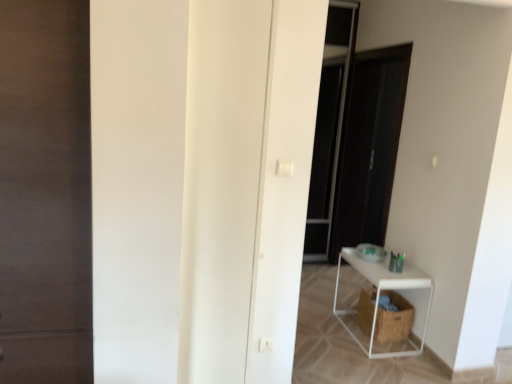
What is the approximate width of brown woven laundry basket at lower right?

It is 31.89 centimeters.

The height and width of the screenshot is (384, 512). Describe the element at coordinates (394, 319) in the screenshot. I see `brown woven laundry basket at lower right` at that location.

Describe the element at coordinates (379, 294) in the screenshot. This screenshot has height=384, width=512. I see `white matte shelf at lower right` at that location.

Describe the element at coordinates (221, 184) in the screenshot. I see `white matte door at center, the 1th door in the right-to-left sequence` at that location.

This screenshot has height=384, width=512. I want to click on dark wood door at left, which appears as the 2th door when viewed from the right, so pos(45,192).

Locate an element on the screen. The width and height of the screenshot is (512, 384). transparent glass screen door at center is located at coordinates (369, 147).

What is the approximate height of transparent glass screen door at center?

It is 6.88 feet.

Locate an element on the screen. The height and width of the screenshot is (384, 512). brown woven laundry basket at lower right is located at coordinates (394, 319).

Between transparent glass screen door at center and brown woven laundry basket at lower right, which one has larger size?

transparent glass screen door at center.

From a real-world perspective, which object stands above the other?

From a 3D spatial view, transparent glass screen door at center is above.

What are the coordinates of `laundry basket in front of the transparent glass screen door at center` in the screenshot? It's located at (394, 319).

Considering the relative positions of transparent glass screen door at center and brown woven laundry basket at lower right in the image provided, is transparent glass screen door at center to the right of brown woven laundry basket at lower right from the viewer's perspective?

Correct, you'll find transparent glass screen door at center to the right of brown woven laundry basket at lower right.

What are the coordinates of `screen door on the right side of dark wood door at left, which appears as the 2th door when viewed from the right` in the screenshot? It's located at (369, 147).

From the image's perspective, is transparent glass screen door at center located beneath dark wood door at left, which appears as the 2th door when viewed from the right?

No.

Is transparent glass screen door at center facing towards dark wood door at left, which appears as the first door when viewed from the left?

No.

Is white matte shelf at lower right spatially inside brown woven laundry basket at lower right, or outside of it?

white matte shelf at lower right is spatially situated outside brown woven laundry basket at lower right.

Is white matte shelf at lower right with brown woven laundry basket at lower right?

No, white matte shelf at lower right is not with brown woven laundry basket at lower right.

Which of these two, white matte shelf at lower right or brown woven laundry basket at lower right, is thinner?

brown woven laundry basket at lower right.

Does white matte shelf at lower right appear on the right side of brown woven laundry basket at lower right?

No, white matte shelf at lower right is not to the right of brown woven laundry basket at lower right.

What are the coordinates of `shelf below the white matte door at center, the 1th door in the right-to-left sequence (from the image's perspective)` in the screenshot? It's located at (379, 294).

Based on the photo, considering the sizes of objects white matte door at center, the 2th door positioned from the left, and white matte shelf at lower right in the image provided, who is thinner, white matte door at center, the 2th door positioned from the left, or white matte shelf at lower right?

With smaller width is white matte door at center, the 2th door positioned from the left.

Is white matte door at center, the 1th door in the right-to-left sequence, outside of white matte shelf at lower right?

white matte door at center, the 1th door in the right-to-left sequence, is positioned outside white matte shelf at lower right.

Between white matte door at center, the 2th door positioned from the left, and white matte shelf at lower right, which one has larger size?

With larger size is white matte door at center, the 2th door positioned from the left.

Which of these two, white matte door at center, the 2th door positioned from the left, or brown woven laundry basket at lower right, stands taller?

Standing taller between the two is white matte door at center, the 2th door positioned from the left.

Can you confirm if white matte door at center, the 2th door positioned from the left, is positioned to the right of brown woven laundry basket at lower right?

No.

Does white matte door at center, the 2th door positioned from the left, come in front of brown woven laundry basket at lower right?

Yes, it is in front of brown woven laundry basket at lower right.

Can you confirm if white matte door at center, the 2th door positioned from the left, is thinner than brown woven laundry basket at lower right?

Indeed, white matte door at center, the 2th door positioned from the left, has a lesser width compared to brown woven laundry basket at lower right.

Is dark wood door at left, which appears as the first door when viewed from the left, oriented away from brown woven laundry basket at lower right?

dark wood door at left, which appears as the first door when viewed from the left, does not have its back to brown woven laundry basket at lower right.

Are dark wood door at left, which appears as the 2th door when viewed from the right, and brown woven laundry basket at lower right beside each other?

No, dark wood door at left, which appears as the 2th door when viewed from the right, is not in contact with brown woven laundry basket at lower right.

From the image's perspective, between dark wood door at left, which appears as the 2th door when viewed from the right, and brown woven laundry basket at lower right, which one is located above?

From the image's view, dark wood door at left, which appears as the 2th door when viewed from the right, is above.

From a real-world perspective, is dark wood door at left, which appears as the 2th door when viewed from the right, physically located above or below brown woven laundry basket at lower right?

In terms of real-world spatial position, dark wood door at left, which appears as the 2th door when viewed from the right, is above brown woven laundry basket at lower right.

Could you tell me if dark wood door at left, which appears as the first door when viewed from the left, is facing transparent glass screen door at center?

No.

Are dark wood door at left, which appears as the 2th door when viewed from the right, and transparent glass screen door at center making contact?

They are not placed beside each other.

From the picture: From a real-world perspective, which is physically above, dark wood door at left, which appears as the 2th door when viewed from the right, or transparent glass screen door at center?

dark wood door at left, which appears as the 2th door when viewed from the right, from a real-world perspective.

Find the location of a particular element. screen door above the brown woven laundry basket at lower right (from a real-world perspective) is located at coordinates (369, 147).

This screenshot has height=384, width=512. What are the coordinates of `screen door lying above the dark wood door at left, which appears as the first door when viewed from the left (from the image's perspective)` in the screenshot? It's located at (369, 147).

Based on their spatial positions, is transparent glass screen door at center or brown woven laundry basket at lower right further from white matte shelf at lower right?

transparent glass screen door at center lies further to white matte shelf at lower right than the other object.

Estimate the real-world distances between objects in this image. Which object is closer to transparent glass screen door at center, white matte door at center, the 1th door in the right-to-left sequence, or brown woven laundry basket at lower right?

Among the two, brown woven laundry basket at lower right is located nearer to transparent glass screen door at center.

Considering their positions, is transparent glass screen door at center positioned closer to white matte door at center, the 1th door in the right-to-left sequence, than white matte shelf at lower right?

The object closer to white matte door at center, the 1th door in the right-to-left sequence, is white matte shelf at lower right.

From the image, which object appears to be farther from white matte door at center, the 2th door positioned from the left, white matte shelf at lower right or brown woven laundry basket at lower right?

brown woven laundry basket at lower right is further to white matte door at center, the 2th door positioned from the left.

Consider the image. When comparing their distances from brown woven laundry basket at lower right, does dark wood door at left, which appears as the first door when viewed from the left, or transparent glass screen door at center seem further?

dark wood door at left, which appears as the first door when viewed from the left, is further to brown woven laundry basket at lower right.

Considering their positions, is white matte door at center, the 1th door in the right-to-left sequence, positioned further to transparent glass screen door at center than white matte shelf at lower right?

white matte door at center, the 1th door in the right-to-left sequence, is further to transparent glass screen door at center.

Looking at the image, which one is located further to white matte shelf at lower right, transparent glass screen door at center or dark wood door at left, which appears as the 2th door when viewed from the right?

dark wood door at left, which appears as the 2th door when viewed from the right, is further to white matte shelf at lower right.

Looking at the image, which one is located closer to brown woven laundry basket at lower right, dark wood door at left, which appears as the first door when viewed from the left, or white matte door at center, the 2th door positioned from the left?

The object closer to brown woven laundry basket at lower right is white matte door at center, the 2th door positioned from the left.

The image size is (512, 384). Find the location of `shelf between white matte door at center, the 1th door in the right-to-left sequence, and transparent glass screen door at center from front to back`. shelf between white matte door at center, the 1th door in the right-to-left sequence, and transparent glass screen door at center from front to back is located at coordinates (379, 294).

The image size is (512, 384). Identify the location of door between dark wood door at left, which appears as the first door when viewed from the left, and brown woven laundry basket at lower right from front to back. (221, 184).

At what (x,y) coordinates should I click in order to perform the action: click on shelf between white matte door at center, the 2th door positioned from the left, and brown woven laundry basket at lower right, along the z-axis. Please return your answer as a coordinate pair (x, y). The width and height of the screenshot is (512, 384). Looking at the image, I should click on (379, 294).

The height and width of the screenshot is (384, 512). Identify the location of door positioned between dark wood door at left, which appears as the first door when viewed from the left, and white matte shelf at lower right from near to far. 221,184.